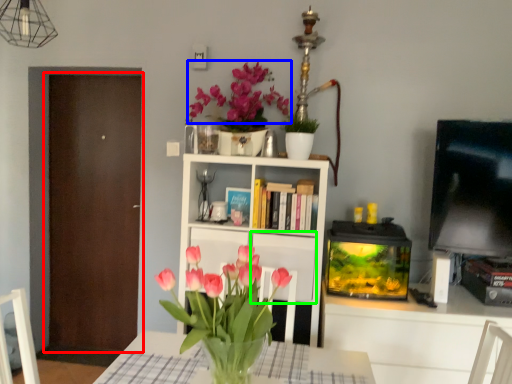
Question: Which object is the farthest from door (highlighted by a red box)? Choose among these: flower (highlighted by a blue box) or cabinet (highlighted by a green box).

Choices:
 (A) flower
 (B) cabinet

Answer: (B)